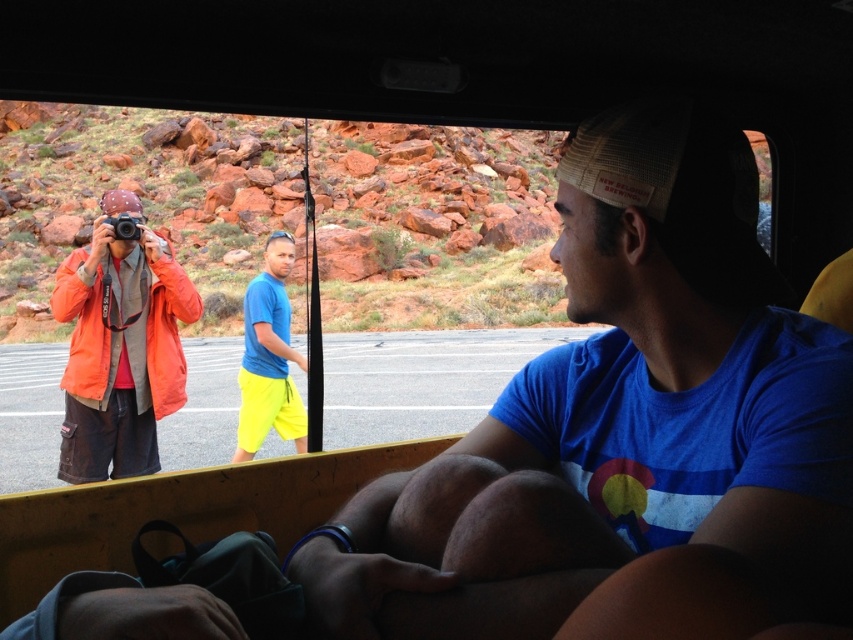
Between orange fabric jacket at left and neon yellow shorts at center, which one is positioned higher?

orange fabric jacket at left is above.

At what (x,y) coordinates should I click in order to perform the action: click on orange fabric jacket at left. Please return your answer as a coordinate pair (x, y). This screenshot has height=640, width=853. Looking at the image, I should click on (120, 346).

The width and height of the screenshot is (853, 640). What do you see at coordinates (120, 346) in the screenshot? I see `orange fabric jacket at left` at bounding box center [120, 346].

Where is `orange fabric jacket at left`? This screenshot has height=640, width=853. orange fabric jacket at left is located at coordinates (120, 346).